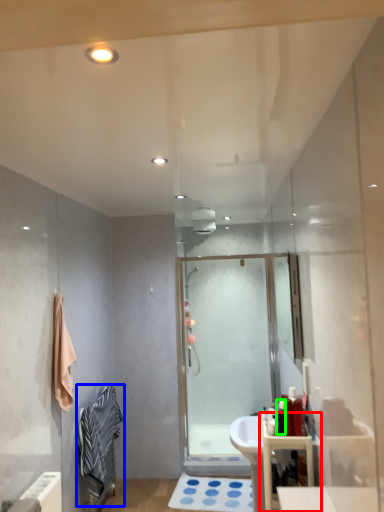
Question: Considering the real-world distances, which object is closest to bathroom cabinet (highlighted by a red box)? bathrobe (highlighted by a blue box) or toiletry (highlighted by a green box).

Choices:
 (A) bathrobe
 (B) toiletry

Answer: (B)